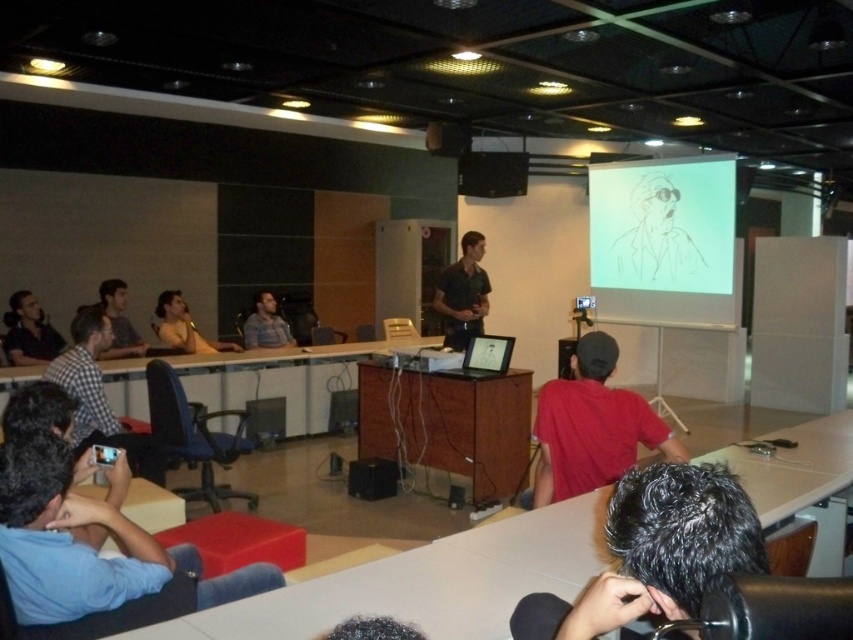
You are standing in the classroom and want to know how far you are from the point marked as point [656,324]. Can you determine the distance?

The point [656,324] is 6.37 meters from the camera, so you are 6.37 meters away from the point [656,324].

You are sitting at the back of the classroom and want to see the presenter clearly. Which person is blocking your view between the matte black shirt at left and the plaid fabric shirt at center?

The matte black shirt at left is blocking your view because it is in front of the plaid fabric shirt at center.

You are an attendee in the classroom and want to know which person is sitting lower between the red matte shirt at lower right and the matte black shirt at left. Based on their positions, can you determine which one is lower?

The red matte shirt at lower right is located below the matte black shirt at left, so the person wearing the red matte shirt at lower right is sitting lower.